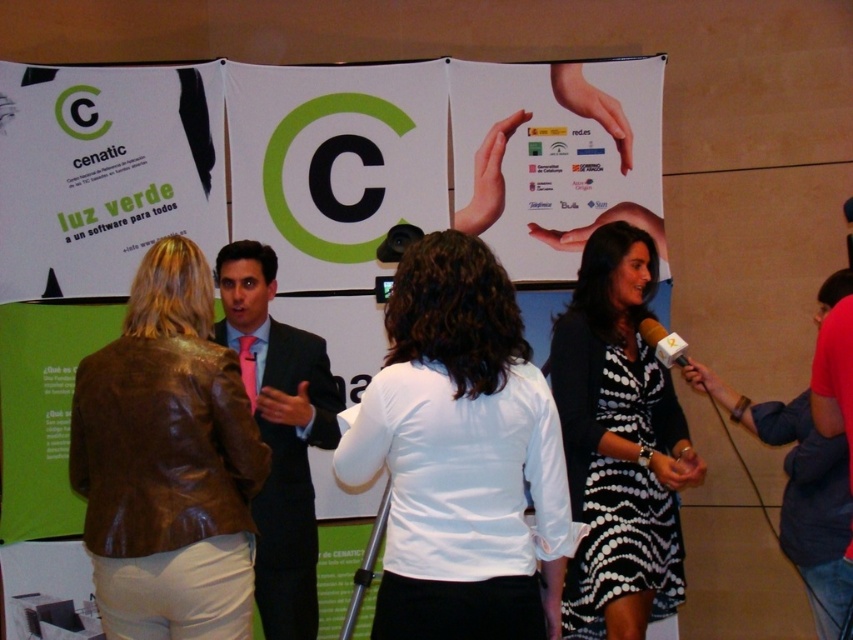
Can you confirm if brown leather jacket at center is positioned to the right of black dotted dress at right?

No, brown leather jacket at center is not to the right of black dotted dress at right.

Is brown leather jacket at center to the left of black dotted dress at right from the viewer's perspective?

Indeed, brown leather jacket at center is positioned on the left side of black dotted dress at right.

Image resolution: width=853 pixels, height=640 pixels. What are the coordinates of `brown leather jacket at center` in the screenshot? It's located at (167, 461).

Can you confirm if brown leather jacket at center is wider than red shirt at lower right?

Yes.

Who is more distant from viewer, (160, 364) or (837, 563)?

The point (837, 563) is behind.

Between point (202, 326) and point (819, 323), which one is positioned behind?

Positioned behind is point (819, 323).

This screenshot has height=640, width=853. What are the coordinates of `brown leather jacket at center` in the screenshot? It's located at (167, 461).

Who is taller, white paper poster at center or brown leather jacket at center?

white paper poster at center is taller.

Consider the image. Between white paper poster at center and brown leather jacket at center, which one is positioned lower?

Positioned lower is brown leather jacket at center.

Which is in front, point (566, 115) or point (148, 541)?

Point (148, 541) is in front.

The width and height of the screenshot is (853, 640). What are the coordinates of `white paper poster at center` in the screenshot? It's located at (300, 209).